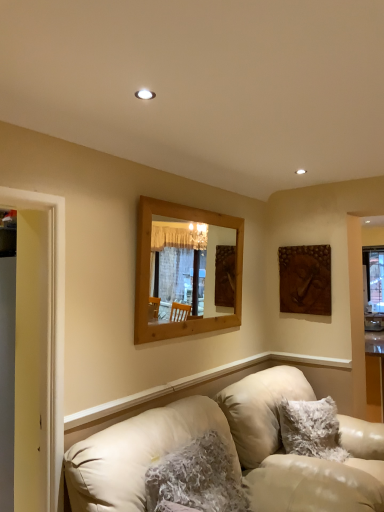
Question: Is leather couch at lower left inside wooden mirror at center?

Choices:
 (A) yes
 (B) no

Answer: (B)

Question: Can you confirm if wooden mirror at center is shorter than leather couch at lower left?

Choices:
 (A) no
 (B) yes

Answer: (A)

Question: Does wooden mirror at center come behind leather couch at lower left?

Choices:
 (A) yes
 (B) no

Answer: (A)

Question: From the image's perspective, is wooden mirror at center above leather couch at lower left?

Choices:
 (A) yes
 (B) no

Answer: (A)

Question: From a real-world perspective, does wooden mirror at center sit lower than leather couch at lower left?

Choices:
 (A) yes
 (B) no

Answer: (B)

Question: Considering the positions of yellow wood door frame at left and fuzzy white pillow at lower right, placed as the 2th pillow when sorted from left to right, in the image, is yellow wood door frame at left taller or shorter than fuzzy white pillow at lower right, placed as the 2th pillow when sorted from left to right,?

Choices:
 (A) short
 (B) tall

Answer: (B)

Question: Based on their positions, is yellow wood door frame at left located to the left or right of fuzzy white pillow at lower right, placed as the 2th pillow when sorted from left to right?

Choices:
 (A) left
 (B) right

Answer: (A)

Question: Is yellow wood door frame at left bigger or smaller than fuzzy white pillow at lower right, which is counted as the 1th pillow, starting from the right?

Choices:
 (A) big
 (B) small

Answer: (B)

Question: Does point (57, 304) appear closer or farther from the camera than point (322, 414)?

Choices:
 (A) farther
 (B) closer

Answer: (B)

Question: From the image's perspective, is fuzzy white pillow at lower center, which ranks as the second pillow in right-to-left order, positioned above or below fuzzy white pillow at lower right, placed as the 2th pillow when sorted from left to right?

Choices:
 (A) below
 (B) above

Answer: (B)

Question: From a real-world perspective, is fuzzy white pillow at lower center, the second pillow from the back, above or below fuzzy white pillow at lower right, which is counted as the 1th pillow, starting from the right?

Choices:
 (A) below
 (B) above

Answer: (A)

Question: Considering the positions of fuzzy white pillow at lower center, the second pillow from the back, and fuzzy white pillow at lower right, marked as the first pillow in a back-to-front arrangement, in the image, is fuzzy white pillow at lower center, the second pillow from the back, taller or shorter than fuzzy white pillow at lower right, marked as the first pillow in a back-to-front arrangement,?

Choices:
 (A) short
 (B) tall

Answer: (B)

Question: Considering the positions of point (205, 477) and point (316, 436), is point (205, 477) closer or farther from the camera than point (316, 436)?

Choices:
 (A) closer
 (B) farther

Answer: (A)

Question: In terms of height, does wooden mirror at center look taller or shorter compared to fuzzy white pillow at lower center, marked as the first pillow in a left-to-right arrangement?

Choices:
 (A) short
 (B) tall

Answer: (B)

Question: Choose the correct answer: Is wooden mirror at center inside fuzzy white pillow at lower center, the second pillow from the back, or outside it?

Choices:
 (A) outside
 (B) inside

Answer: (A)